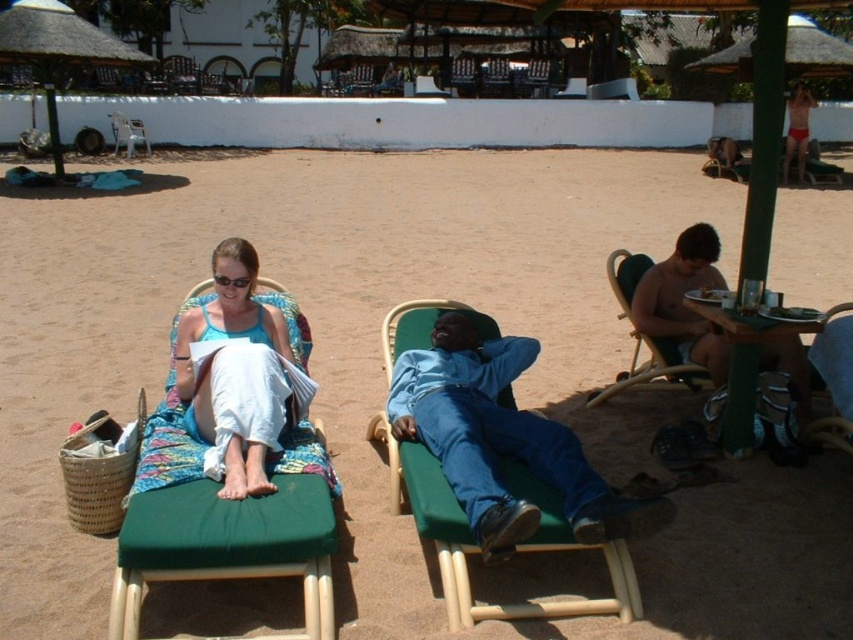
From the picture: You are standing in front of the beach scene and want to know which of the two points, point (796,417) or point (828,316), is closer to you. Can you determine this based on their positions?

Point (796,417) is closer to the camera than point (828,316), so it is closer to you.

You are a photographer standing at the edge of the beach. You want to take a photo that includes both the denim blue jeans at center and the green fabric beach chair at left. Based on their positions, can you fit both subjects into your camera frame without moving either object? Explain your reasoning.

The denim blue jeans at center and green fabric beach chair at left are 31.56 inches apart. Since the distance between them is relatively close, it should be possible to capture both in the same frame without moving either object, provided the camera has an appropriate lens or zoom setting to accommodate the spacing between them.

You are a lifeguard who needs to quickly move from the green fabric beach chair at left to the denim blue jeans at center. Can you pass through the space between them without bending?

The denim blue jeans at center might be wider than green fabric beach chair at left, so there might be enough space for the lifeguard to pass through without bending, but it depends on the exact width difference.